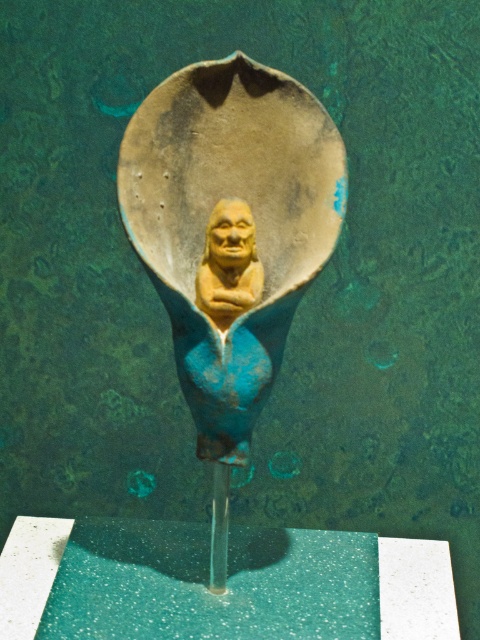
Question: Observing the image, what is the correct spatial positioning of matte yellow figure at center in reference to matte yellow bust at center?

Choices:
 (A) left
 (B) right

Answer: (A)

Question: Can you confirm if matte yellow figure at center is thinner than matte yellow bust at center?

Choices:
 (A) yes
 (B) no

Answer: (B)

Question: Is matte yellow figure at center wider than matte yellow bust at center?

Choices:
 (A) no
 (B) yes

Answer: (B)

Question: Among these points, which one is farthest from the camera?

Choices:
 (A) (224, 243)
 (B) (164, 195)

Answer: (B)

Question: Among these objects, which one is farthest from the camera?

Choices:
 (A) matte yellow bust at center
 (B) matte yellow figure at center

Answer: (A)